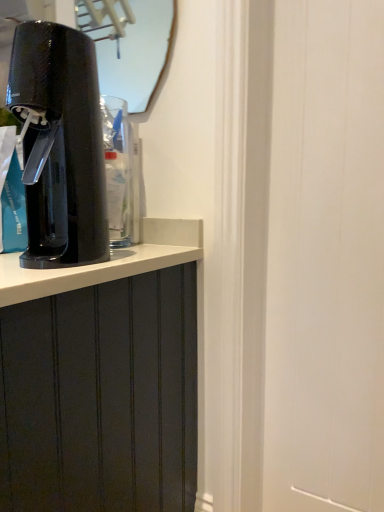
Question: Can you confirm if transparent plastic water cooler at left is wider than matte glass mirror at upper center?

Choices:
 (A) no
 (B) yes

Answer: (B)

Question: From a real-world perspective, is transparent plastic water cooler at left on matte glass mirror at upper center?

Choices:
 (A) no
 (B) yes

Answer: (A)

Question: Can matte glass mirror at upper center be found inside transparent plastic water cooler at left?

Choices:
 (A) yes
 (B) no

Answer: (B)

Question: Does transparent plastic water cooler at left have a greater height compared to matte glass mirror at upper center?

Choices:
 (A) yes
 (B) no

Answer: (A)

Question: From the image's perspective, is transparent plastic water cooler at left located beneath matte glass mirror at upper center?

Choices:
 (A) yes
 (B) no

Answer: (A)

Question: Does point (147, 69) appear closer or farther from the camera than point (46, 172)?

Choices:
 (A) closer
 (B) farther

Answer: (B)

Question: Is matte glass mirror at upper center in front of or behind black glossy soda maker at left in the image?

Choices:
 (A) behind
 (B) front

Answer: (A)

Question: In terms of width, does matte glass mirror at upper center look wider or thinner when compared to black glossy soda maker at left?

Choices:
 (A) thin
 (B) wide

Answer: (A)

Question: From a real-world perspective, is matte glass mirror at upper center positioned above or below black glossy soda maker at left?

Choices:
 (A) below
 (B) above

Answer: (B)

Question: Based on their sizes in the image, would you say transparent plastic water cooler at left is bigger or smaller than black glossy soda maker at left?

Choices:
 (A) small
 (B) big

Answer: (A)

Question: From a real-world perspective, is transparent plastic water cooler at left physically located above or below black glossy soda maker at left?

Choices:
 (A) above
 (B) below

Answer: (B)

Question: In terms of width, does transparent plastic water cooler at left look wider or thinner when compared to black glossy soda maker at left?

Choices:
 (A) thin
 (B) wide

Answer: (A)

Question: Is transparent plastic water cooler at left taller or shorter than black glossy soda maker at left?

Choices:
 (A) short
 (B) tall

Answer: (A)

Question: Considering the positions of black glossy soda maker at left and matte glass mirror at upper center in the image, is black glossy soda maker at left bigger or smaller than matte glass mirror at upper center?

Choices:
 (A) small
 (B) big

Answer: (B)

Question: From a real-world perspective, relative to matte glass mirror at upper center, is black glossy soda maker at left vertically above or below?

Choices:
 (A) below
 (B) above

Answer: (A)